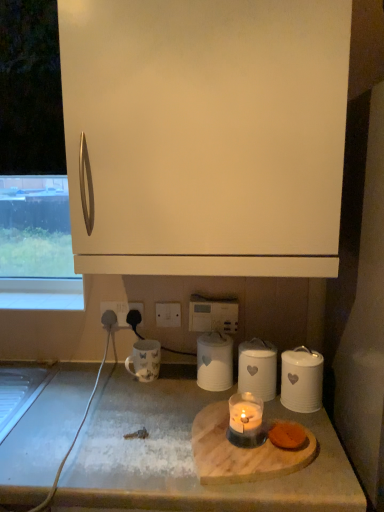
This screenshot has width=384, height=512. Describe the element at coordinates (246, 421) in the screenshot. I see `translucent glass candle at center` at that location.

What is the approximate height of translucent glass candle at center?

It is 2.94 inches.

At what (x,y) coordinates should I click in order to perform the action: click on white matte canister at center, placed as the second kitchen appliance when sorted from left to right. Please return your answer as a coordinate pair (x, y). The image size is (384, 512). Looking at the image, I should click on (257, 368).

What do you see at coordinates (122, 311) in the screenshot? I see `black plastic outlet at lower center` at bounding box center [122, 311].

Locate an element on the screen. This screenshot has width=384, height=512. black plastic outlet at lower center is located at coordinates (122, 311).

Describe the element at coordinates (205, 135) in the screenshot. I see `white matte cabinet at upper center` at that location.

Locate an element on the screen. The image size is (384, 512). translucent glass candle at center is located at coordinates (246, 421).

In the scene shown: From the image's perspective, between white ceramic canister at center, positioned as the 1th kitchen appliance in left-to-right order, and black plastic outlet at lower center, which one is located above?

black plastic outlet at lower center.

Is white ceramic canister at center, which appears as the 3th kitchen appliance when viewed from the right, inside the boundaries of black plastic outlet at lower center, or outside?

white ceramic canister at center, which appears as the 3th kitchen appliance when viewed from the right, is outside black plastic outlet at lower center.

Is white ceramic canister at center, which appears as the 3th kitchen appliance when viewed from the right, facing towards black plastic outlet at lower center?

No, white ceramic canister at center, which appears as the 3th kitchen appliance when viewed from the right, does not turn towards black plastic outlet at lower center.

Which object is positioned more to the right, white ceramic canister at center, positioned as the 1th kitchen appliance in left-to-right order, or black plastic outlet at lower center?

From the viewer's perspective, white ceramic canister at center, positioned as the 1th kitchen appliance in left-to-right order, appears more on the right side.

Is the depth of white glossy mug at lower left less than that of white matte canister at lower right, which is the 1th kitchen appliance in right-to-left order?

No.

In the scene shown: From a real-world perspective, who is located higher, white glossy mug at lower left or white matte canister at lower right, which ranks as the third kitchen appliance in left-to-right order?

white matte canister at lower right, which ranks as the third kitchen appliance in left-to-right order, from a real-world perspective.

I want to click on coffee cup that is behind the white matte canister at lower right, which is the 1th kitchen appliance in right-to-left order, so click(x=145, y=360).

Is point (139, 361) closer or farther from the camera than point (300, 377)?

Point (139, 361) appears to be farther away from the viewer than point (300, 377).

How different are the orientations of white rubber cable at lower left and black plastic outlet at lower center in degrees?

0.431 degrees separate the facing orientations of white rubber cable at lower left and black plastic outlet at lower center.

Does white rubber cable at lower left touch black plastic outlet at lower center?

They are not placed beside each other.

From the picture: Is white rubber cable at lower left turned away from black plastic outlet at lower center?

No.

From a real-world perspective, is white rubber cable at lower left beneath black plastic outlet at lower center?

Yes, from a real-world perspective, white rubber cable at lower left is under black plastic outlet at lower center.

Is black plastic outlet at lower center in front of or behind white matte canister at lower right, which ranks as the third kitchen appliance in left-to-right order, in the image?

black plastic outlet at lower center is behind white matte canister at lower right, which ranks as the third kitchen appliance in left-to-right order.

From a real-world perspective, relative to white matte canister at lower right, which is the 1th kitchen appliance in right-to-left order, is black plastic outlet at lower center vertically above or below?

black plastic outlet at lower center is above white matte canister at lower right, which is the 1th kitchen appliance in right-to-left order.

Is black plastic outlet at lower center next to white matte canister at lower right, which ranks as the third kitchen appliance in left-to-right order?

No, black plastic outlet at lower center is not beside white matte canister at lower right, which ranks as the third kitchen appliance in left-to-right order.

Between black plastic outlet at lower center and white matte canister at lower right, which ranks as the third kitchen appliance in left-to-right order, which one appears on the left side from the viewer's perspective?

black plastic outlet at lower center is more to the left.

Is white matte cabinet at upper center behind wooden cutting board at center?

No, the depth of white matte cabinet at upper center is less than that of wooden cutting board at center.

Does white matte cabinet at upper center have a lesser height compared to wooden cutting board at center?

In fact, white matte cabinet at upper center may be taller than wooden cutting board at center.

Based on the photo, does white matte cabinet at upper center turn towards wooden cutting board at center?

No, white matte cabinet at upper center is not aimed at wooden cutting board at center.

From the image's perspective, who appears lower, white matte cabinet at upper center or wooden cutting board at center?

wooden cutting board at center.

The width and height of the screenshot is (384, 512). In order to click on appliance below the black plastic outlet at lower center (from the image's perspective) in this screenshot , I will do `click(241, 452)`.

How many degrees apart are the facing directions of black plastic outlet at lower center and wooden cutting board at center?

black plastic outlet at lower center and wooden cutting board at center are facing 44.4 degrees away from each other.

From the picture: Is black plastic outlet at lower center oriented away from wooden cutting board at center?

black plastic outlet at lower center is not turned away from wooden cutting board at center.

Which is more to the left, black plastic outlet at lower center or wooden cutting board at center?

black plastic outlet at lower center is more to the left.

This screenshot has height=512, width=384. Find the location of `appliance below the black plastic outlet at lower center (from a real-world perspective)`. appliance below the black plastic outlet at lower center (from a real-world perspective) is located at coordinates (241, 452).

How many degrees apart are the facing directions of wooden cutting board at center and black plastic outlet at lower center?

They differ by 44.4 degrees in their facing directions.

Between point (221, 417) and point (123, 318), which one is positioned behind?

The point (123, 318) is farther from the camera.

In the image, is wooden cutting board at center positioned in front of or behind black plastic outlet at lower center?

Clearly, wooden cutting board at center is in front of black plastic outlet at lower center.

This screenshot has width=384, height=512. In order to click on electric outlet lying behind the white ceramic canister at center, which appears as the 3th kitchen appliance when viewed from the right in this screenshot , I will do `click(122, 311)`.

There is a white glossy mug at lower left. Where is `the 2nd kitchen appliance below it (from the image's perspective)`? Image resolution: width=384 pixels, height=512 pixels. the 2nd kitchen appliance below it (from the image's perspective) is located at coordinates (301, 380).

Considering their positions, is wooden cutting board at center positioned closer to white ceramic canister at center, which appears as the 3th kitchen appliance when viewed from the right, than white matte canister at center, placed as the second kitchen appliance when sorted from left to right?

white matte canister at center, placed as the second kitchen appliance when sorted from left to right, lies closer to white ceramic canister at center, which appears as the 3th kitchen appliance when viewed from the right, than the other object.

When comparing their distances from black plastic outlet at lower center, does white matte canister at center, the 2th kitchen appliance positioned from the right, or white glossy mug at lower left seem further?

white matte canister at center, the 2th kitchen appliance positioned from the right, is further to black plastic outlet at lower center.

Based on their spatial positions, is black plastic outlet at lower center or wooden cutting board at lower center further from white matte canister at lower right, which ranks as the third kitchen appliance in left-to-right order?

black plastic outlet at lower center is positioned further to the anchor white matte canister at lower right, which ranks as the third kitchen appliance in left-to-right order.

Based on the photo, which object lies nearer to the anchor point black plastic outlet at lower center, translucent glass candle at center or white matte canister at center, placed as the second kitchen appliance when sorted from left to right?

white matte canister at center, placed as the second kitchen appliance when sorted from left to right.

Considering their positions, is white glossy mug at lower left positioned closer to white ceramic canister at center, positioned as the 1th kitchen appliance in left-to-right order, than translucent glass candle at center?

translucent glass candle at center lies closer to white ceramic canister at center, positioned as the 1th kitchen appliance in left-to-right order, than the other object.

From the image, which object appears to be nearer to white rubber cable at lower left, black plastic outlet at lower center or white matte cabinet at upper center?

Among the two, black plastic outlet at lower center is located nearer to white rubber cable at lower left.

Estimate the real-world distances between objects in this image. Which object is closer to white matte canister at lower right, which is the 1th kitchen appliance in right-to-left order, white matte canister at center, the 2th kitchen appliance positioned from the right, or white glossy mug at lower left?

white matte canister at center, the 2th kitchen appliance positioned from the right.

Considering their positions, is white matte canister at center, placed as the second kitchen appliance when sorted from left to right, positioned closer to white matte canister at lower right, which ranks as the third kitchen appliance in left-to-right order, than translucent glass candle at center?

white matte canister at center, placed as the second kitchen appliance when sorted from left to right, is closer to white matte canister at lower right, which ranks as the third kitchen appliance in left-to-right order.

This screenshot has width=384, height=512. In order to click on coffee cup between white rubber cable at lower left and white matte canister at lower right, which ranks as the third kitchen appliance in left-to-right order, in the horizontal direction in this screenshot , I will do `click(145, 360)`.

This screenshot has width=384, height=512. In order to click on kitchen appliance positioned between translucent glass candle at center and white matte canister at center, the 2th kitchen appliance positioned from the right, from near to far in this screenshot , I will do pos(301,380).

Where is `candle holder between white rubber cable at lower left and white matte canister at lower right, which is the 1th kitchen appliance in right-to-left order`? candle holder between white rubber cable at lower left and white matte canister at lower right, which is the 1th kitchen appliance in right-to-left order is located at coordinates (246, 421).

Locate an element on the screen. The width and height of the screenshot is (384, 512). coffee cup between white matte cabinet at upper center and white rubber cable at lower left in the up-down direction is located at coordinates (145, 360).